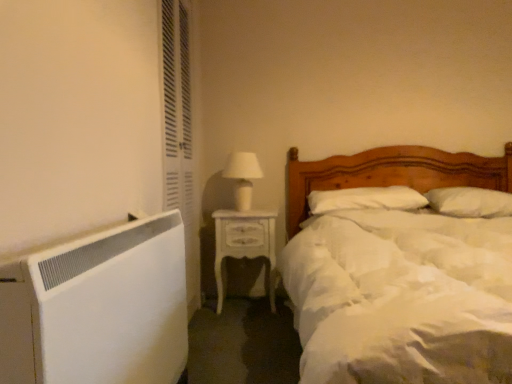
This screenshot has height=384, width=512. What do you see at coordinates (180, 134) in the screenshot? I see `white textured screen door at left` at bounding box center [180, 134].

Describe the element at coordinates (245, 245) in the screenshot. I see `white glossy nightstand at center` at that location.

Find the location of `white glossy nightstand at center`. white glossy nightstand at center is located at coordinates (245, 245).

The height and width of the screenshot is (384, 512). Describe the element at coordinates (470, 202) in the screenshot. I see `white soft pillow at upper right, acting as the 1th pillow starting from the right` at that location.

What is the approximate width of white soft pillow at upper right, acting as the 1th pillow starting from the right?

white soft pillow at upper right, acting as the 1th pillow starting from the right, is 16.44 inches wide.

Describe the element at coordinates (400, 274) in the screenshot. I see `white matte wood bed at center` at that location.

Identify the location of white textured screen door at left. This screenshot has height=384, width=512. (180, 134).

Is white matte wood bed at center thinner than white textured screen door at left?

No, white matte wood bed at center is not thinner than white textured screen door at left.

Considering the sizes of objects white matte wood bed at center and white textured screen door at left in the image provided, who is taller, white matte wood bed at center or white textured screen door at left?

white textured screen door at left.

From the image's perspective, is white matte wood bed at center beneath white textured screen door at left?

Yes, from the image's perspective, white matte wood bed at center is beneath white textured screen door at left.

From a real-world perspective, who is located higher, white matte wood bed at center or white textured screen door at left?

white textured screen door at left is physically above.

Consider the image. Considering the sizes of white glossy nightstand at center and white glossy table lamp at upper center in the image, is white glossy nightstand at center taller or shorter than white glossy table lamp at upper center?

Clearly, white glossy nightstand at center is taller compared to white glossy table lamp at upper center.

Is white glossy nightstand at center wider or thinner than white glossy table lamp at upper center?

In the image, white glossy nightstand at center appears to be wider than white glossy table lamp at upper center.

From the image's perspective, relative to white glossy table lamp at upper center, is white glossy nightstand at center above or below?

From the image's perspective, white glossy nightstand at center appears below white glossy table lamp at upper center.

Considering the positions of objects white glossy nightstand at center and white glossy table lamp at upper center in the image provided, who is more to the right, white glossy nightstand at center or white glossy table lamp at upper center?

white glossy nightstand at center is more to the right.

Based on the photo, is white glossy table lamp at upper center inside the boundaries of white glossy nightstand at center, or outside?

white glossy table lamp at upper center is located beyond the bounds of white glossy nightstand at center.

Which is farther from the camera, (x=234, y=191) or (x=222, y=267)?

The point (x=234, y=191) is behind.

Which is more to the left, white glossy table lamp at upper center or white glossy nightstand at center?

white glossy table lamp at upper center.

Is white glossy table lamp at upper center bigger than white glossy nightstand at center?

No, white glossy table lamp at upper center is not bigger than white glossy nightstand at center.

Is white soft pillow at center, which is the 1th pillow in left-to-right order, positioned beyond the bounds of white matte wood bed at center?

No, white soft pillow at center, which is the 1th pillow in left-to-right order, is not entirely external to white matte wood bed at center.

Which of these two, white soft pillow at center, marked as the second pillow in a right-to-left arrangement, or white matte wood bed at center, is thinner?

Thinner between the two is white soft pillow at center, marked as the second pillow in a right-to-left arrangement.

Is white soft pillow at center, which is the 1th pillow in left-to-right order, to the left of white matte wood bed at center from the viewer's perspective?

Correct, you'll find white soft pillow at center, which is the 1th pillow in left-to-right order, to the left of white matte wood bed at center.

From the image's perspective, is white soft pillow at center, marked as the second pillow in a right-to-left arrangement, on top of white matte wood bed at center?

Yes, from the image's perspective, white soft pillow at center, marked as the second pillow in a right-to-left arrangement, is over white matte wood bed at center.

From a real-world perspective, is white matte wood bed at center positioned under white soft pillow at upper right, the 2th pillow in the left-to-right sequence, based on gravity?

Yes, from a real-world perspective, white matte wood bed at center is below white soft pillow at upper right, the 2th pillow in the left-to-right sequence.

The width and height of the screenshot is (512, 384). There is a white matte wood bed at center. Identify the location of the 1st pillow above it (from the image's perspective). (470, 202).

Is white matte wood bed at center oriented away from white soft pillow at upper right, the 2th pillow in the left-to-right sequence?

Yes, white matte wood bed at center is facing away from white soft pillow at upper right, the 2th pillow in the left-to-right sequence.

Does white matte wood bed at center have a lesser width compared to white glossy nightstand at center?

No.

Is white matte wood bed at center in front of or behind white glossy nightstand at center in the image?

In the image, white matte wood bed at center appears in front of white glossy nightstand at center.

Is white glossy nightstand at center at the back of white matte wood bed at center?

No, white matte wood bed at center is not facing away from white glossy nightstand at center.

Considering the positions of point (316, 369) and point (273, 279), is point (316, 369) closer or farther from the camera than point (273, 279)?

Point (316, 369) is positioned closer to the camera compared to point (273, 279).

From a real-world perspective, is white matte wood bed at center over white glossy table lamp at upper center?

No, from a real-world perspective, white matte wood bed at center is not on top of white glossy table lamp at upper center.

Looking at this image, is white glossy table lamp at upper center at the back of white matte wood bed at center?

white matte wood bed at center does not have its back to white glossy table lamp at upper center.

Considering the positions of points (394, 251) and (251, 200), is point (394, 251) closer to camera compared to point (251, 200)?

Yes, it is in front of point (251, 200).

Consider the image. Who is taller, white matte wood bed at center or white glossy table lamp at upper center?

white matte wood bed at center is taller.

Identify the location of bed below the white textured screen door at left (from a real-world perspective). The height and width of the screenshot is (384, 512). (400, 274).

The image size is (512, 384). I want to click on nightstand in front of the white glossy table lamp at upper center, so click(245, 245).

Considering their positions, is white matte wood bed at center positioned closer to white textured screen door at left than white soft pillow at upper right, the 2th pillow in the left-to-right sequence?

Based on the image, white matte wood bed at center appears to be nearer to white textured screen door at left.

Which object lies nearer to the anchor point white glossy nightstand at center, white soft pillow at center, marked as the second pillow in a right-to-left arrangement, or white soft pillow at upper right, acting as the 1th pillow starting from the right?

Among the two, white soft pillow at center, marked as the second pillow in a right-to-left arrangement, is located nearer to white glossy nightstand at center.

From the image, which object appears to be farther from white soft pillow at upper right, the 2th pillow in the left-to-right sequence, white soft pillow at center, marked as the second pillow in a right-to-left arrangement, or white matte wood bed at center?

white matte wood bed at center is further to white soft pillow at upper right, the 2th pillow in the left-to-right sequence.

Which object lies further to the anchor point white soft pillow at center, marked as the second pillow in a right-to-left arrangement, white matte wood bed at center or white glossy nightstand at center?

white glossy nightstand at center is positioned further to the anchor white soft pillow at center, marked as the second pillow in a right-to-left arrangement.

From the image, which object appears to be nearer to white soft pillow at upper right, the 2th pillow in the left-to-right sequence, white soft pillow at center, marked as the second pillow in a right-to-left arrangement, or white glossy nightstand at center?

white soft pillow at center, marked as the second pillow in a right-to-left arrangement.

From the image, which object appears to be farther from white soft pillow at upper right, acting as the 1th pillow starting from the right, white textured screen door at left or white matte wood bed at center?

white textured screen door at left lies further to white soft pillow at upper right, acting as the 1th pillow starting from the right, than the other object.

From the picture: Which object lies nearer to the anchor point white soft pillow at upper right, the 2th pillow in the left-to-right sequence, white glossy nightstand at center or white soft pillow at center, which is the 1th pillow in left-to-right order?

white soft pillow at center, which is the 1th pillow in left-to-right order, is closer to white soft pillow at upper right, the 2th pillow in the left-to-right sequence.

Looking at this image, from the image, which object appears to be nearer to white glossy nightstand at center, white textured screen door at left or white matte wood bed at center?

white textured screen door at left.

Locate an element on the screen. nightstand between white textured screen door at left and white glossy table lamp at upper center in the front-back direction is located at coordinates (245, 245).

This screenshot has height=384, width=512. I want to click on screen door located between white matte wood bed at center and white glossy nightstand at center in the depth direction, so pos(180,134).

At what (x,y) coordinates should I click in order to perform the action: click on nightstand situated between white textured screen door at left and white soft pillow at center, which is the 1th pillow in left-to-right order, from left to right. Please return your answer as a coordinate pair (x, y). The width and height of the screenshot is (512, 384). Looking at the image, I should click on (245, 245).

At what (x,y) coordinates should I click in order to perform the action: click on pillow between white glossy table lamp at upper center and white soft pillow at upper right, acting as the 1th pillow starting from the right, from left to right. Please return your answer as a coordinate pair (x, y). Looking at the image, I should click on (366, 199).